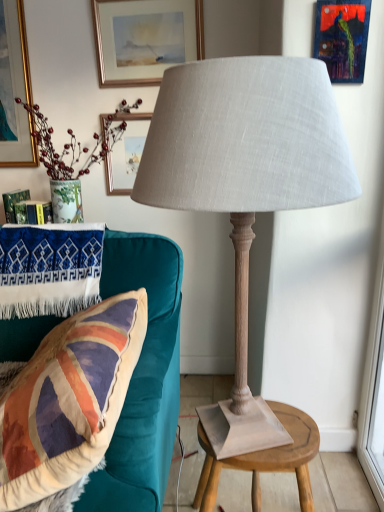
Question: From a real-world perspective, is metallic blue painting at upper right, arranged as the second picture frame when viewed from the top, positioned under matte gold picture frame at upper center, arranged as the 1th picture frame when viewed from the left, based on gravity?

Choices:
 (A) no
 (B) yes

Answer: (B)

Question: Is metallic blue painting at upper right, which is counted as the 2th picture frame, starting from the left, facing away from matte gold picture frame at upper center, marked as the 2th picture frame in a right-to-left arrangement?

Choices:
 (A) yes
 (B) no

Answer: (B)

Question: Can you confirm if metallic blue painting at upper right, which is counted as the 2th picture frame, starting from the left, is wider than matte gold picture frame at upper center, which is counted as the first picture frame, starting from the top?

Choices:
 (A) yes
 (B) no

Answer: (B)

Question: Does metallic blue painting at upper right, marked as the 2th picture frame in a back-to-front arrangement, appear on the right side of matte gold picture frame at upper center, placed as the 2th picture frame when sorted from front to back?

Choices:
 (A) no
 (B) yes

Answer: (B)

Question: Can you confirm if metallic blue painting at upper right, positioned as the first picture frame in bottom-to-top order, is thinner than matte gold picture frame at upper center, marked as the 2th picture frame in a right-to-left arrangement?

Choices:
 (A) yes
 (B) no

Answer: (A)

Question: Can you confirm if metallic blue painting at upper right, which is counted as the 2th picture frame, starting from the left, is taller than matte gold picture frame at upper center, marked as the 2th picture frame in a right-to-left arrangement?

Choices:
 (A) yes
 (B) no

Answer: (B)

Question: Is matte gold picture frame at upper center, marked as the 2th picture frame in a right-to-left arrangement, surrounding matte gray fabric lamp at center?

Choices:
 (A) yes
 (B) no

Answer: (B)

Question: Is matte gold picture frame at upper center, placed as the 2th picture frame when sorted from bottom to top, positioned behind matte gray fabric lamp at center?

Choices:
 (A) yes
 (B) no

Answer: (A)

Question: Are matte gold picture frame at upper center, placed as the 2th picture frame when sorted from front to back, and matte gray fabric lamp at center beside each other?

Choices:
 (A) no
 (B) yes

Answer: (A)

Question: Does matte gold picture frame at upper center, placed as the 2th picture frame when sorted from bottom to top, appear on the right side of matte gray fabric lamp at center?

Choices:
 (A) yes
 (B) no

Answer: (B)

Question: Is matte gold picture frame at upper center, arranged as the 1th picture frame when viewed from the left, oriented towards matte gray fabric lamp at center?

Choices:
 (A) yes
 (B) no

Answer: (B)

Question: Is matte gold picture frame at upper center, which is counted as the first picture frame, starting from the top, outside matte gray fabric lamp at center?

Choices:
 (A) no
 (B) yes

Answer: (B)

Question: Would you say velvet union jack pillow at left is part of matte gold picture frame at upper center, which is counted as the first picture frame, starting from the top,'s contents?

Choices:
 (A) yes
 (B) no

Answer: (B)